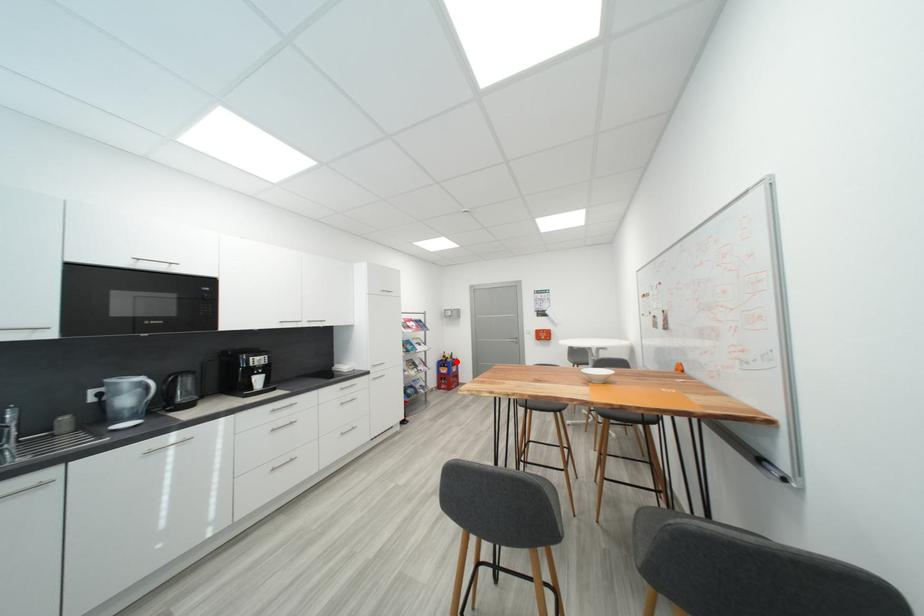
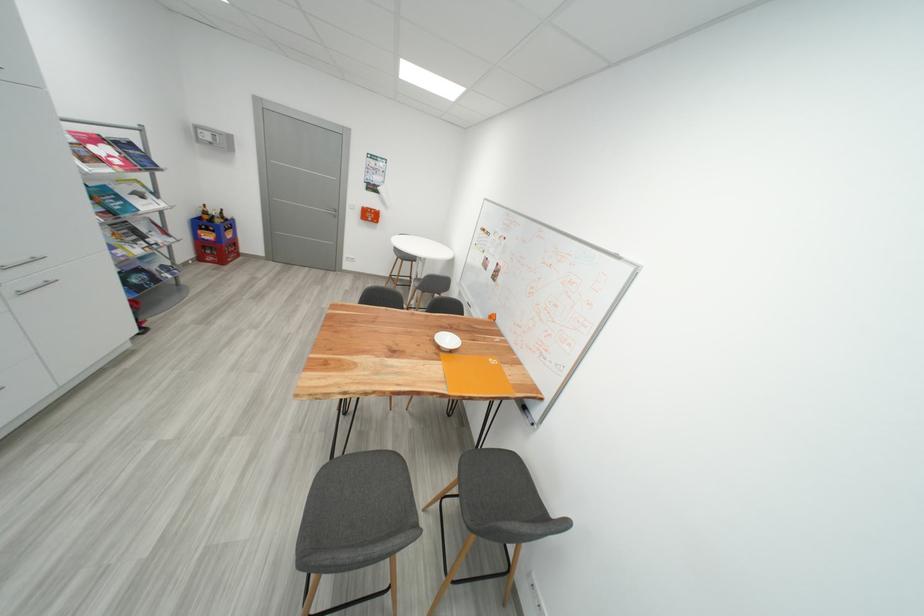
Where in the second image is the point corresponding to the highlighted location from the first image?

(225, 223)